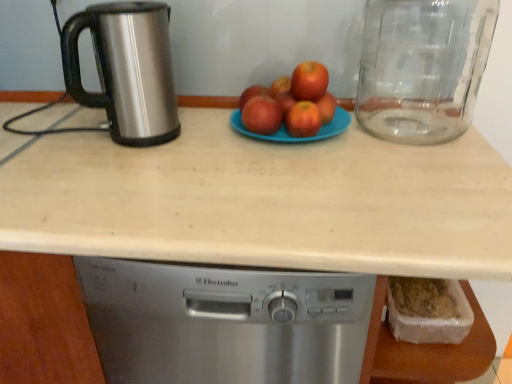
Locate an element on the screen. free point below transparent glass jar at right (from a real-world perspective) is located at coordinates (409, 125).